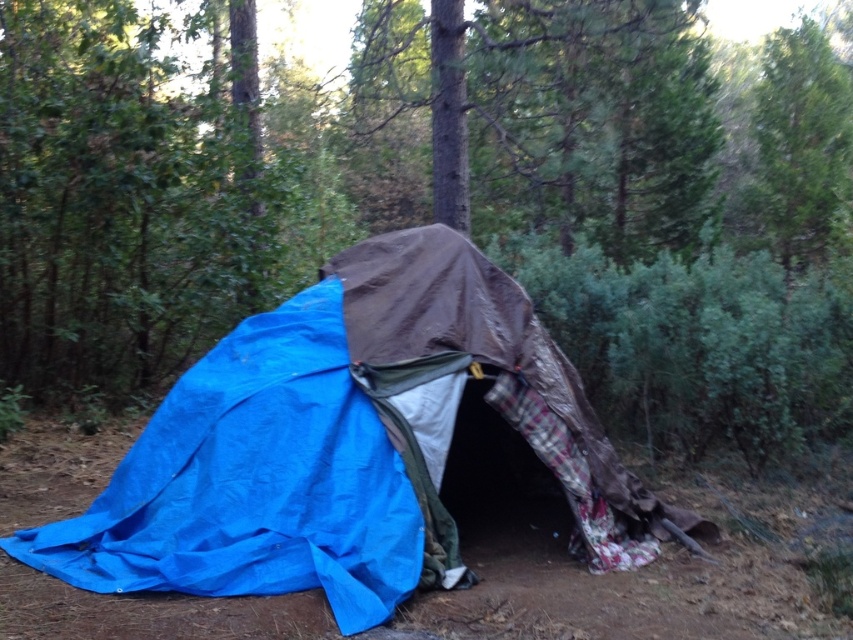
Question: Is blue tarp at center bigger than green leafy tree at upper right?

Choices:
 (A) no
 (B) yes

Answer: (A)

Question: Which point is farther to the camera?

Choices:
 (A) (660, 512)
 (B) (747, 230)

Answer: (B)

Question: Where is blue tarp at center located in relation to green leafy tree at upper right in the image?

Choices:
 (A) above
 (B) below

Answer: (B)

Question: In this image, where is blue tarp at center located relative to green leafy tree at upper right?

Choices:
 (A) left
 (B) right

Answer: (A)

Question: Which object is farther from the camera taking this photo?

Choices:
 (A) green leafy tree at upper right
 (B) blue tarp at center

Answer: (A)